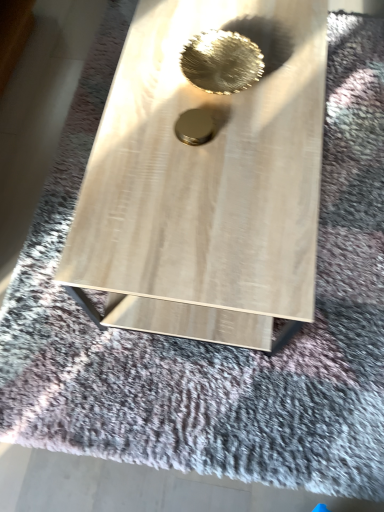
The width and height of the screenshot is (384, 512). Identify the location of vacant space behind gold metallic circle at center, arranged as the first hole when ordered from the bottom. (193, 75).